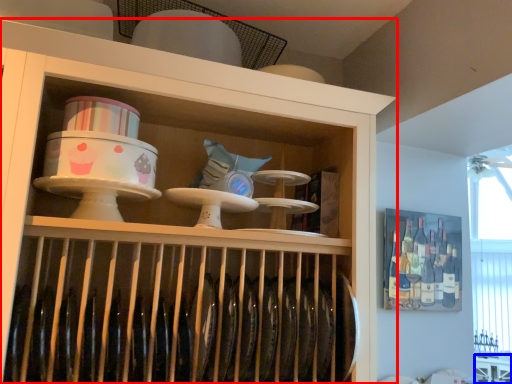
Question: Which object appears farthest to the camera in this image, shelf (highlighted by a red box) or table (highlighted by a blue box)?

Choices:
 (A) shelf
 (B) table

Answer: (B)